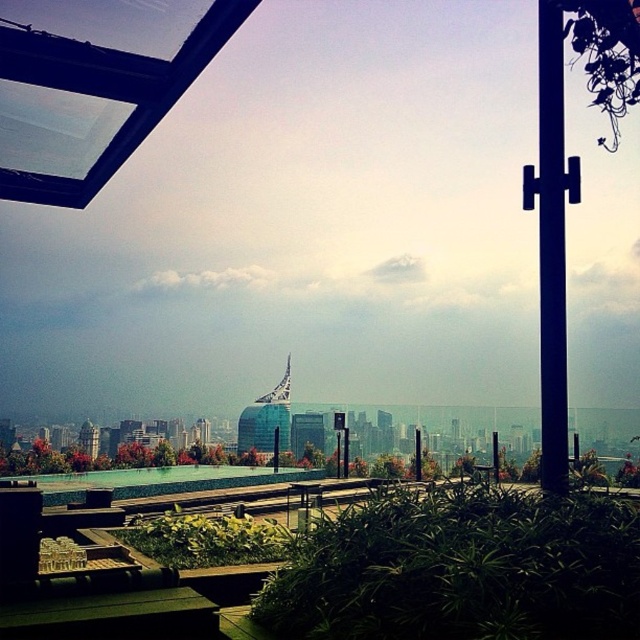
Which is behind, point (545, 371) or point (342, 458)?

The point (342, 458) is more distant.

Can you confirm if black metal pole at right is wider than black metal pole at center?

Yes, black metal pole at right is wider than black metal pole at center.

This screenshot has width=640, height=640. Find the location of `black metal pole at right`. black metal pole at right is located at coordinates (552, 250).